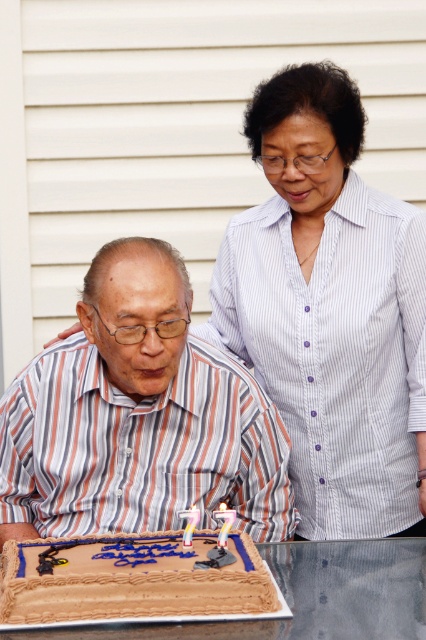
Describe the element at coordinates (330, 308) in the screenshot. The width and height of the screenshot is (426, 640). I see `white striped shirt at upper right` at that location.

Which is below, white striped shirt at upper right or striped shirt at center?

striped shirt at center is lower down.

Image resolution: width=426 pixels, height=640 pixels. What do you see at coordinates (330, 308) in the screenshot?
I see `white striped shirt at upper right` at bounding box center [330, 308].

The image size is (426, 640). Find the location of `white striped shirt at upper right`. white striped shirt at upper right is located at coordinates (x=330, y=308).

Which is in front, point (230, 516) or point (189, 508)?

Point (230, 516)

Is point (221, 536) behind point (178, 512)?

No, it is not.

The image size is (426, 640). What are the coordinates of `translucent plastic candle at lower center` in the screenshot? It's located at (224, 522).

Is point (416, 221) positioned in front of point (399, 568)?

No, (416, 221) is further to viewer.

The width and height of the screenshot is (426, 640). I want to click on white striped shirt at upper right, so click(x=330, y=308).

The height and width of the screenshot is (640, 426). What do you see at coordinates (330, 308) in the screenshot? I see `white striped shirt at upper right` at bounding box center [330, 308].

At what (x,y) coordinates should I click in order to perform the action: click on white striped shirt at upper right. Please return your answer as a coordinate pair (x, y). Looking at the image, I should click on (330, 308).